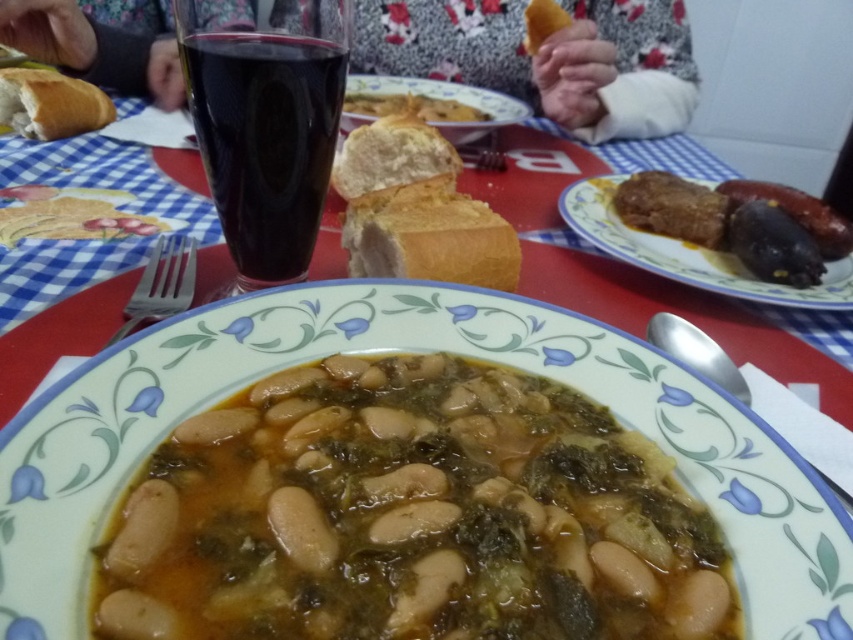
Is white soft bread at upper left closer to camera compared to silver spoon at lower right?

No, white soft bread at upper left is behind silver spoon at lower right.

Which is above, white soft bread at upper left or silver spoon at lower right?

Positioned higher is white soft bread at upper left.

Image resolution: width=853 pixels, height=640 pixels. Describe the element at coordinates (50, 104) in the screenshot. I see `white soft bread at upper left` at that location.

Locate an element on the screen. The image size is (853, 640). white soft bread at upper left is located at coordinates (50, 104).

Does white matte beans at center have a lesser height compared to matte ceramic plate at center?

Yes.

Which is above, white matte beans at center or matte ceramic plate at center?

matte ceramic plate at center is higher up.

Who is more distant from viewer, [276,564] or [424,84]?

Point [424,84]

At what (x,y) coordinates should I click in order to perform the action: click on white matte beans at center. Please return your answer as a coordinate pair (x, y). The width and height of the screenshot is (853, 640). Looking at the image, I should click on (410, 516).

Does matte ceramic plate at center have a greater height compared to satin silver fork at left?

Yes, matte ceramic plate at center is taller than satin silver fork at left.

Does matte ceramic plate at center have a greater width compared to satin silver fork at left?

Yes, matte ceramic plate at center is wider than satin silver fork at left.

The width and height of the screenshot is (853, 640). Find the location of `matte ceramic plate at center`. matte ceramic plate at center is located at coordinates (447, 99).